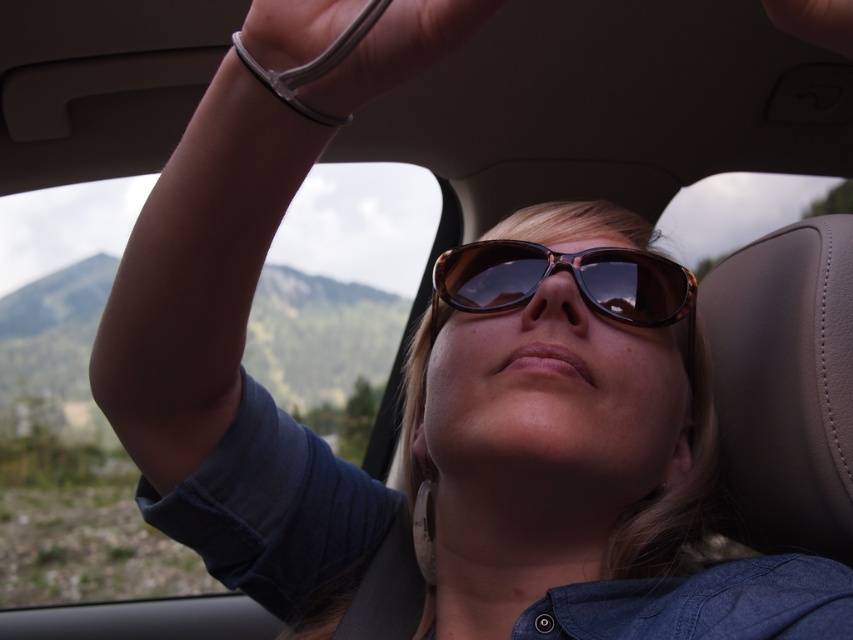
You are a designer working on a car interior layout. You need to ensure that the clear plastic wristband at upper center and the tortoiseshell sunglasses at center are positioned so that there is enough space between them for a 10 inch safety margin. Based on the image, is the current spacing sufficient?

The distance between the clear plastic wristband at upper center and the tortoiseshell sunglasses at center is 12.25 inches, which exceeds the required 10 inch safety margin, so the current spacing is sufficient.

You are a medical professional checking the wrist of a patient in the car. You see the clear plastic wristband at upper center and the dark skin at upper center. Which object is wider?

The clear plastic wristband at upper center is wider than the dark skin at upper center according to the description.

You are a fashion designer observing the clear plastic wristband at upper center and the tortoiseshell sunglasses at center. Which accessory is smaller in size?

The clear plastic wristband at upper center is smaller than the tortoiseshell sunglasses at center.